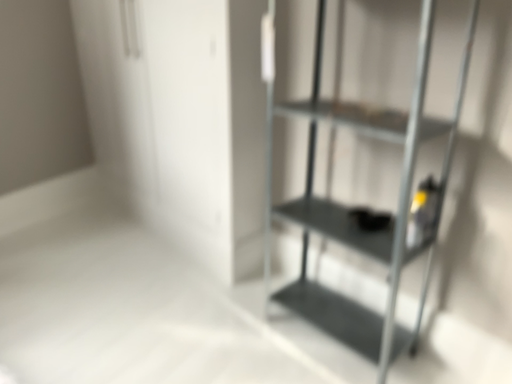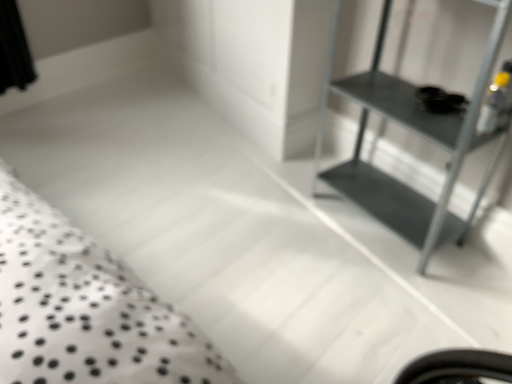
Question: Which way did the camera rotate in the video?

Choices:
 (A) rotated downward
 (B) rotated upward

Answer: (A)